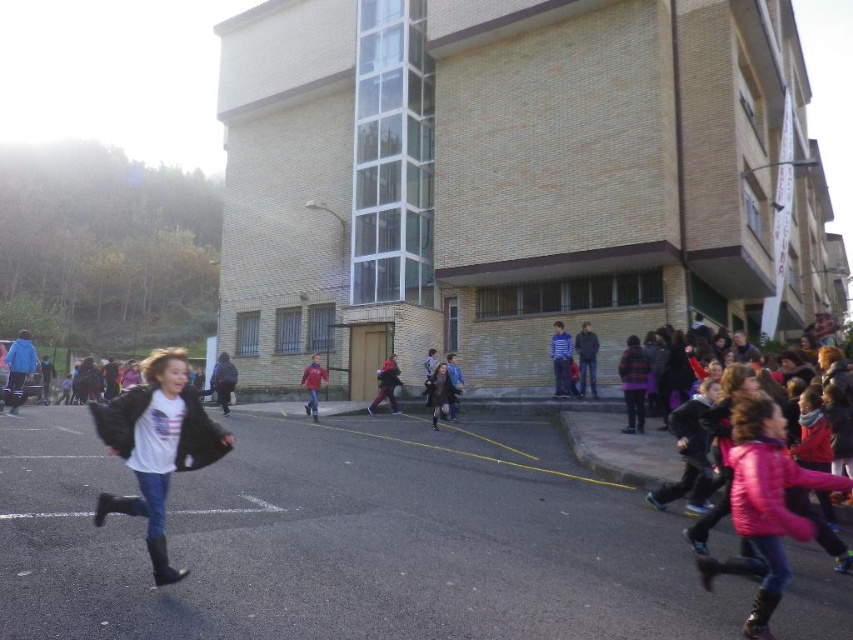
Does point (28, 536) come farther from viewer compared to point (311, 412)?

No.

Is black asphalt at lower left above matte red jacket at center?

No.

Is point (514, 449) in front of point (305, 404)?

Yes, point (514, 449) is in front of point (305, 404).

At what (x,y) coordinates should I click in order to perform the action: click on black asphalt at lower left. Please return your answer as a coordinate pair (x, y). Looking at the image, I should click on (347, 540).

Is the position of matte black jacket at center less distant than that of matte red jacket at center?

No, it is behind matte red jacket at center.

You are a GUI agent. You are given a task and a screenshot of the screen. Output one action in this format:
    pyautogui.click(x=<x>, y=<y>)
    Task: Click on the matte black jacket at center
    The width and height of the screenshot is (853, 640).
    Given the screenshot: What is the action you would take?
    pyautogui.click(x=386, y=385)

Looking at this image, which is more to the left, brick building at center or matte red jacket at center?

Positioned to the left is matte red jacket at center.

Does brick building at center have a larger size compared to matte red jacket at center?

Yes, brick building at center is bigger than matte red jacket at center.

Is point (492, 328) in front of point (312, 387)?

No, it is behind (312, 387).

Where is `brick building at center`? The width and height of the screenshot is (853, 640). brick building at center is located at coordinates [x=511, y=179].